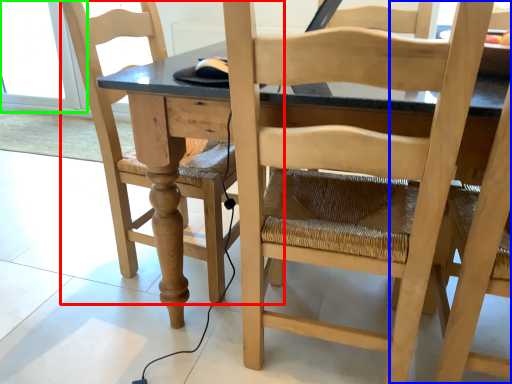
Question: Estimate the real-world distances between objects in this image. Which object is farther from chair (highlighted by a red box), chair (highlighted by a blue box) or glass door (highlighted by a green box)?

Choices:
 (A) chair
 (B) glass door

Answer: (B)